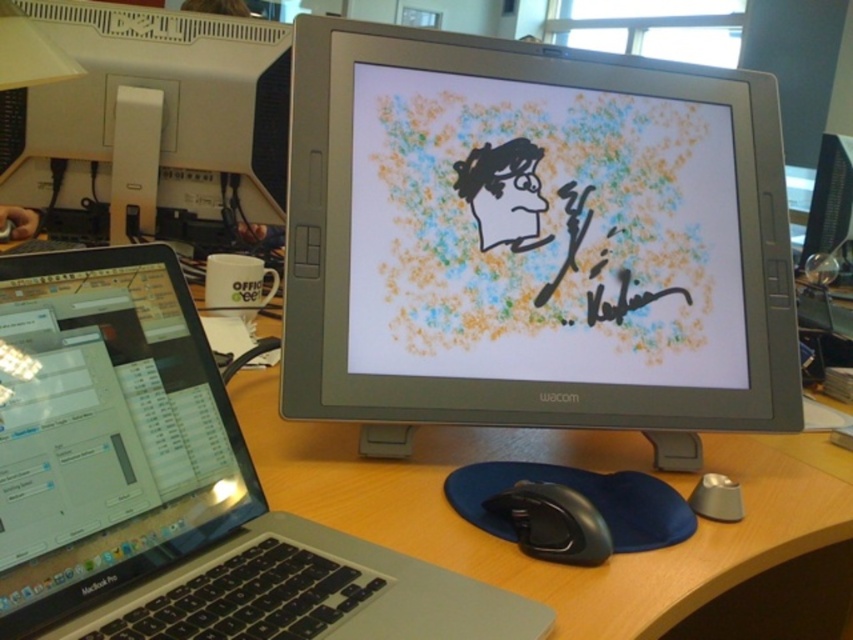
Question: Which point is farther to the camera?

Choices:
 (A) (22, 620)
 (B) (254, 202)
 (C) (817, 228)

Answer: (C)

Question: Can you confirm if satin black monitor at upper left is positioned below matte black monitor at upper right?

Choices:
 (A) yes
 (B) no

Answer: (B)

Question: Which point is closer to the camera?

Choices:
 (A) (171, 93)
 (B) (500, 492)
 (C) (815, 216)

Answer: (B)

Question: Is slate gray monitor at center closer to the viewer compared to black rubberized mouse at lower center?

Choices:
 (A) yes
 (B) no

Answer: (B)

Question: Can you confirm if satin black monitor at upper left is thinner than black rubberized mouse at lower center?

Choices:
 (A) no
 (B) yes

Answer: (A)

Question: Which of the following is the closest to the observer?

Choices:
 (A) slate gray monitor at center
 (B) black rubberized mouse at lower center

Answer: (B)